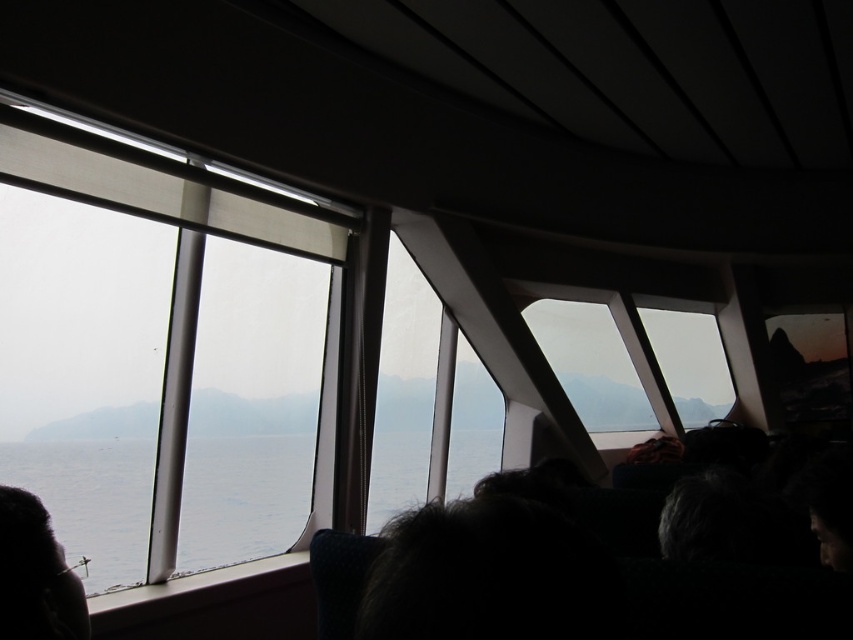
Question: Which of the following is the closest to the observer?

Choices:
 (A) (630, 500)
 (B) (282, 506)
 (C) (67, 580)

Answer: (C)

Question: Can you confirm if clear glass window at upper left is positioned above dark hair at lower left?

Choices:
 (A) no
 (B) yes

Answer: (B)

Question: Estimate the real-world distances between objects in this image. Which object is closer to the dark hair at lower left?

Choices:
 (A) transparent glass water at center
 (B) clear glass window at upper left

Answer: (A)

Question: Among these objects, which one is nearest to the camera?

Choices:
 (A) dark hair at lower left
 (B) clear glass window at upper left

Answer: (A)

Question: Can you confirm if clear glass window at upper left is bigger than dark hair at lower left?

Choices:
 (A) no
 (B) yes

Answer: (B)

Question: Can you confirm if clear glass window at upper left is bigger than transparent glass water at center?

Choices:
 (A) no
 (B) yes

Answer: (B)